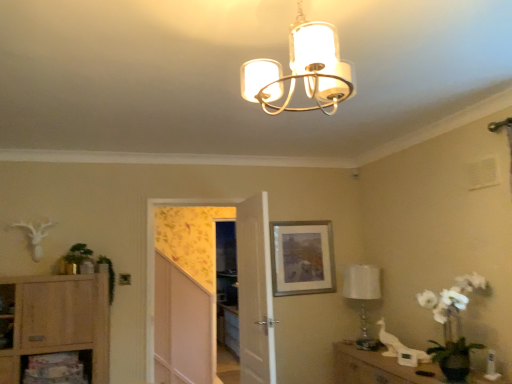
Identify the location of free space above transparent glass screen door at center (from a real-world perspective). (194, 192).